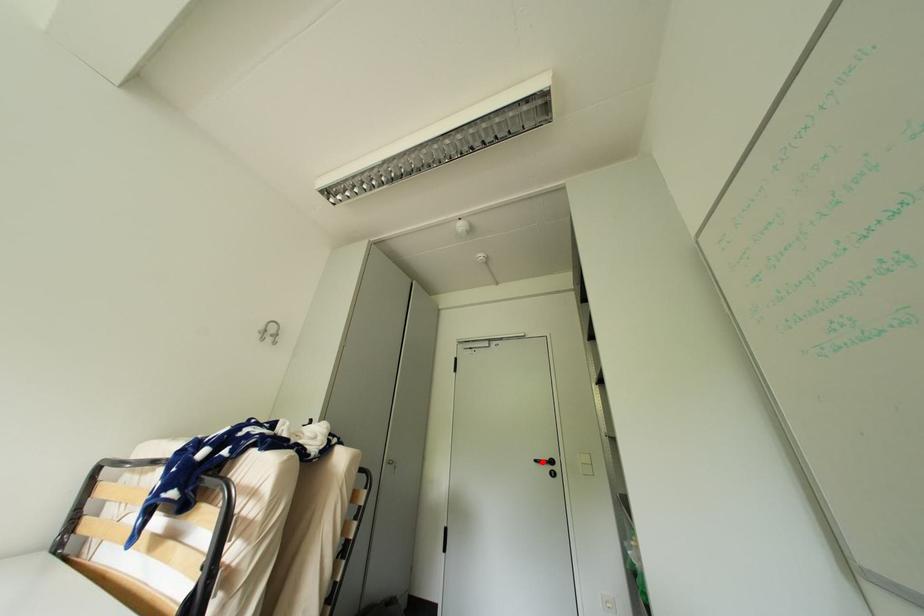
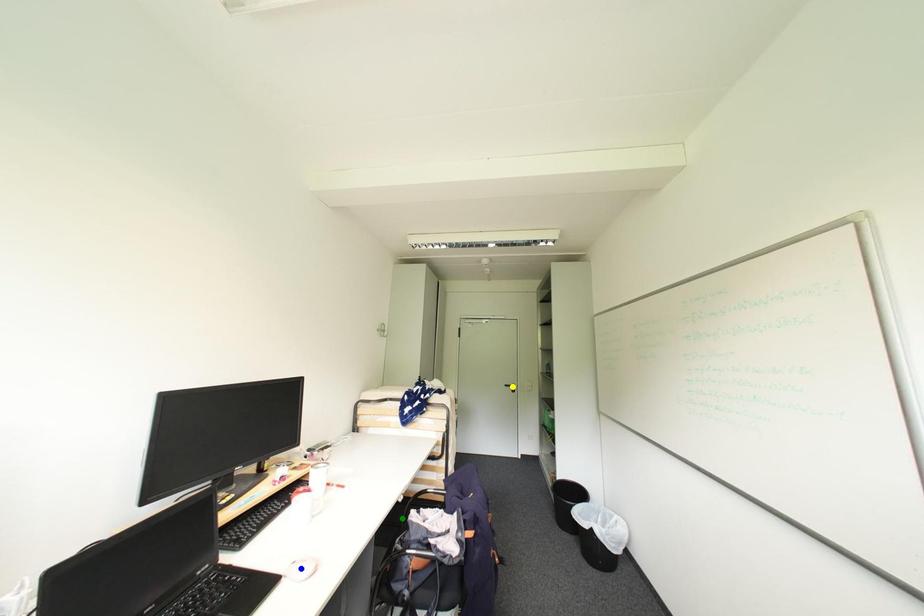
Question: I am providing you with two images of the same scene from different viewpoints. A red point is marked on the first image. You are given multiple points on the second image. Can you choose the point in image 2 that corresponds to the point in image 1?

Choices:
 (A) yellow point
 (B) blue point
 (C) green point

Answer: (A)